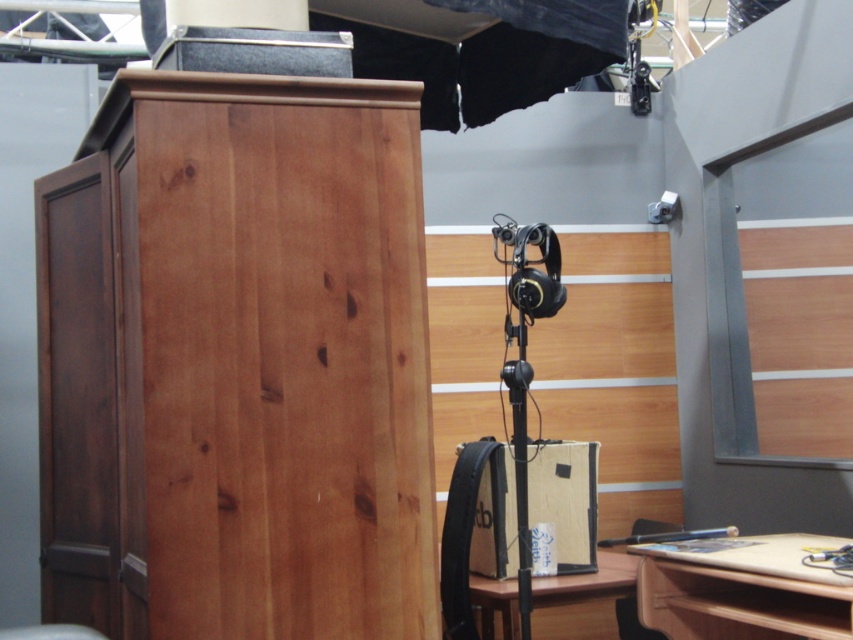
Based on the photo, you are setting up a recording studio and need to place a large mixing console that requires 2 meters of space. You see the wooden desk at lower right and the wooden desk at lower center in the studio. Which desk should you choose to accommodate the mixing console?

The wooden desk at lower right has a larger width than the wooden desk at lower center, so you should choose the wooden desk at lower right to accommodate the mixing console since it provides more space.

You are setting up a microphone stand and need to choose between the wooden desk at lower right and the wooden desk at lower center for placing it. Which desk has enough space to accommodate the microphone stand comfortably?

The wooden desk at lower right is larger in size than the wooden desk at lower center, so it has enough space to accommodate the microphone stand comfortably.